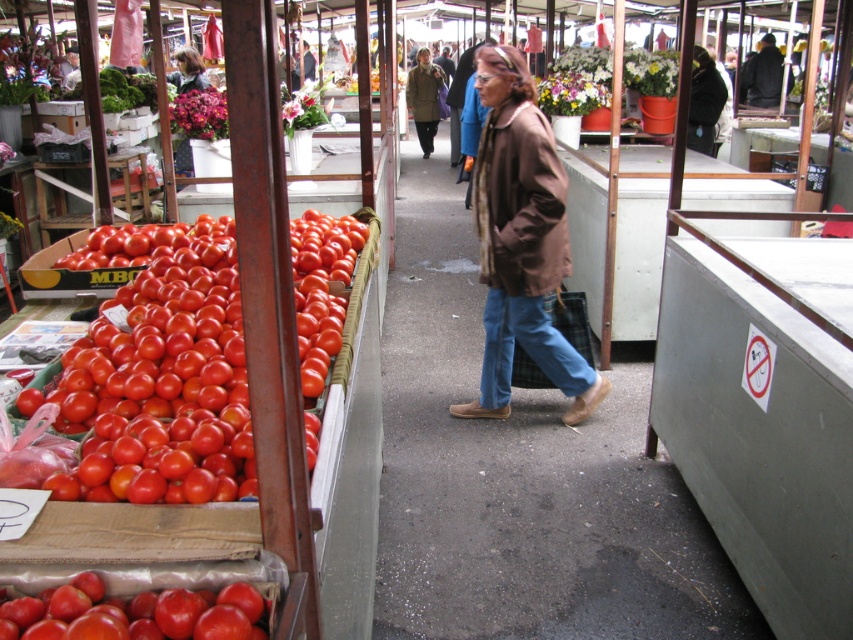
Can you confirm if shiny red tomatoes at left is taller than glossy red tomato at left?

Yes.

Is shiny red tomatoes at left bigger than glossy red tomato at left?

Indeed, shiny red tomatoes at left has a larger size compared to glossy red tomato at left.

Is point (97, 497) in front of point (148, 611)?

That is False.

Locate an element on the screen. shiny red tomatoes at left is located at coordinates (158, 390).

Does brown leather jacket at center appear over brown textured trench coat at center?

No, brown leather jacket at center is not above brown textured trench coat at center.

Is brown leather jacket at center below brown textured trench coat at center?

Indeed, brown leather jacket at center is positioned under brown textured trench coat at center.

Which is in front, point (532, 161) or point (544, 132)?

Point (532, 161) is more forward.

Locate an element on the screen. brown leather jacket at center is located at coordinates (521, 241).

Can you confirm if shiny red tomatoes at left is smaller than brown leather jacket at center?

Result: Actually, shiny red tomatoes at left might be larger than brown leather jacket at center.

Does point (120, 426) come closer to viewer compared to point (486, 353)?

Yes, point (120, 426) is closer to viewer.

Does point (206, 422) come in front of point (486, 192)?

Yes, point (206, 422) is closer to viewer.

Image resolution: width=853 pixels, height=640 pixels. What are the coordinates of `shiny red tomatoes at left` in the screenshot? It's located at (158, 390).